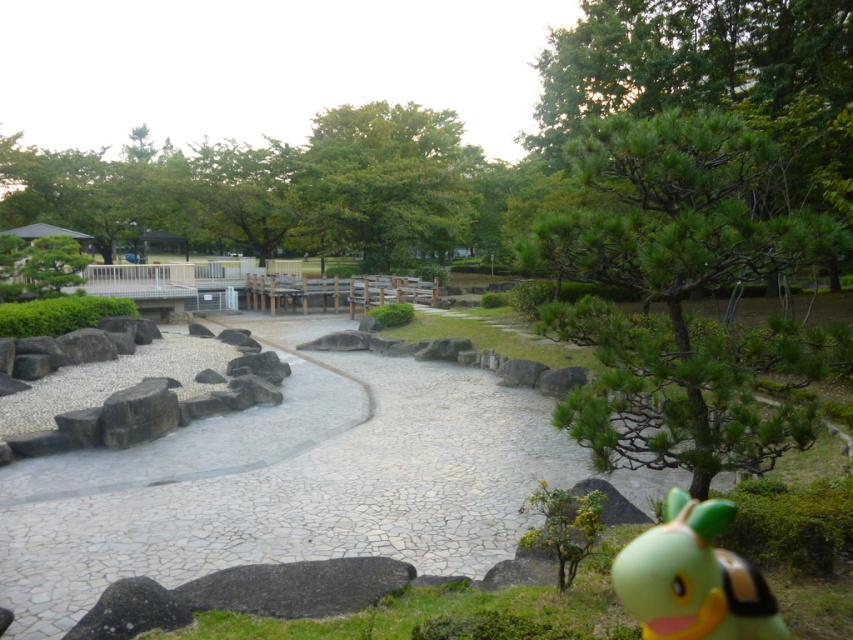
Question: Which is farther from the green leafy tree at center?

Choices:
 (A) green textured tree at upper right
 (B) green leafy tree at upper center
 (C) white stone path at center
 (D) green rubber toy at lower right

Answer: (A)

Question: Does white stone path at center appear on the right side of green leafy tree at center?

Choices:
 (A) yes
 (B) no

Answer: (A)

Question: Among these objects, which one is farthest from the camera?

Choices:
 (A) green rubber toy at lower right
 (B) green leafy tree at upper center

Answer: (B)

Question: Does green textured tree at upper right appear on the left side of green leafy tree at center?

Choices:
 (A) no
 (B) yes

Answer: (A)

Question: Which object is farther from the camera taking this photo?

Choices:
 (A) green textured tree at upper right
 (B) white stone path at center

Answer: (B)

Question: Can you confirm if green textured tree at upper right is positioned to the left of green leafy tree at center?

Choices:
 (A) no
 (B) yes

Answer: (A)